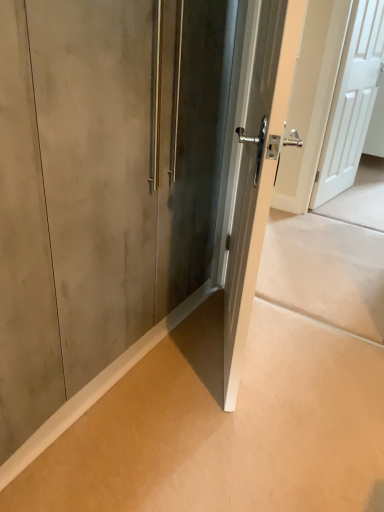
Describe the element at coordinates (351, 101) in the screenshot. The width and height of the screenshot is (384, 512). I see `white matte door at upper right, the 1th door viewed from the right` at that location.

You are a GUI agent. You are given a task and a screenshot of the screen. Output one action in this format:
    pyautogui.click(x=<x>, y=<y>)
    Task: Click on the matte concrete wall at lower left
    
    Given the screenshot: What is the action you would take?
    pyautogui.click(x=226, y=426)

Where is `satin silver door at center, placed as the 1th door when sorted from left to right`? satin silver door at center, placed as the 1th door when sorted from left to right is located at coordinates (256, 164).

Does point (328, 149) lie behind point (133, 449)?

Yes.

Which of these two, white matte door at upper right, the 1th door viewed from the right, or matte concrete wall at lower left, stands taller?

white matte door at upper right, the 1th door viewed from the right.

Considering the relative sizes of white matte door at upper right, which ranks as the second door in left-to-right order, and matte concrete wall at lower left in the image provided, is white matte door at upper right, which ranks as the second door in left-to-right order, bigger than matte concrete wall at lower left?

Yes, white matte door at upper right, which ranks as the second door in left-to-right order, is bigger than matte concrete wall at lower left.

At what (x,y) coordinates should I click in order to perform the action: click on concrete located below the white matte door at upper right, the 1th door from the back (from the image's perspective). Please return your answer as a coordinate pair (x, y). Looking at the image, I should click on (226, 426).

Is there a large distance between satin silver door at center, placed as the 1th door when sorted from left to right, and matte concrete wall at lower left?

They are positioned close to each other.

Considering the relative sizes of satin silver door at center, acting as the first door starting from the front, and matte concrete wall at lower left in the image provided, is satin silver door at center, acting as the first door starting from the front, bigger than matte concrete wall at lower left?

Indeed, satin silver door at center, acting as the first door starting from the front, has a larger size compared to matte concrete wall at lower left.

Is matte concrete wall at lower left surrounded by satin silver door at center, arranged as the 2th door when viewed from the right?

No, matte concrete wall at lower left is located outside of satin silver door at center, arranged as the 2th door when viewed from the right.

Is the position of satin silver door at center, arranged as the 2th door when viewed from the right, less distant than that of matte concrete wall at lower left?

That is False.

Considering the sizes of objects white matte door at upper right, the 1th door viewed from the right, and satin silver door at center, placed as the 1th door when sorted from left to right, in the image provided, who is smaller, white matte door at upper right, the 1th door viewed from the right, or satin silver door at center, placed as the 1th door when sorted from left to right,?

With smaller size is satin silver door at center, placed as the 1th door when sorted from left to right.

Consider the image. Is white matte door at upper right, which ranks as the second door in left-to-right order, inside the boundaries of satin silver door at center, the 2th door positioned from the back, or outside?

white matte door at upper right, which ranks as the second door in left-to-right order, lies outside satin silver door at center, the 2th door positioned from the back.

Is satin silver door at center, placed as the 1th door when sorted from left to right, at the back of white matte door at upper right, which ranks as the second door in left-to-right order?

No, satin silver door at center, placed as the 1th door when sorted from left to right, is not at the back of white matte door at upper right, which ranks as the second door in left-to-right order.

Considering the sizes of objects matte concrete wall at lower left and white matte door at upper right, which ranks as the 2th door in front-to-back order, in the image provided, who is taller, matte concrete wall at lower left or white matte door at upper right, which ranks as the 2th door in front-to-back order,?

Standing taller between the two is white matte door at upper right, which ranks as the 2th door in front-to-back order.

Is there a large distance between matte concrete wall at lower left and white matte door at upper right, the 1th door viewed from the right?

That's right, there is a large distance between matte concrete wall at lower left and white matte door at upper right, the 1th door viewed from the right.

This screenshot has width=384, height=512. What are the coordinates of `door that is the 2nd object located above the matte concrete wall at lower left (from the image's perspective)` in the screenshot? It's located at (351, 101).

What's the angular difference between matte concrete wall at lower left and satin silver door at center, acting as the first door starting from the front,'s facing directions?

They differ by 64 degrees in their facing directions.

Is matte concrete wall at lower left facing away from satin silver door at center, arranged as the 2th door when viewed from the right?

No, matte concrete wall at lower left is not facing the opposite direction of satin silver door at center, arranged as the 2th door when viewed from the right.

Which object is wider, matte concrete wall at lower left or satin silver door at center, placed as the 1th door when sorted from left to right?

With larger width is matte concrete wall at lower left.

In the scene shown: Does satin silver door at center, acting as the first door starting from the front, have a lesser height compared to white matte door at upper right, the 1th door viewed from the right?

Yes, satin silver door at center, acting as the first door starting from the front, is shorter than white matte door at upper right, the 1th door viewed from the right.

Is satin silver door at center, placed as the 1th door when sorted from left to right, positioned with its back to white matte door at upper right, which ranks as the 2th door in front-to-back order?

No, white matte door at upper right, which ranks as the 2th door in front-to-back order, is not at the back of satin silver door at center, placed as the 1th door when sorted from left to right.

Is point (252, 271) closer or farther from the camera than point (340, 170)?

Point (252, 271).

Is satin silver door at center, the 2th door positioned from the back, at the left side of white matte door at upper right, which ranks as the second door in left-to-right order?

Yes.

What are the coordinates of `concrete beneath the white matte door at upper right, which ranks as the 2th door in front-to-back order (from a real-world perspective)` in the screenshot? It's located at point(226,426).

At what (x,y) coordinates should I click in order to perform the action: click on the 1st door behind when counting from the matte concrete wall at lower left. Please return your answer as a coordinate pair (x, y). The image size is (384, 512). Looking at the image, I should click on (256, 164).

Looking at the image, which one is located closer to white matte door at upper right, the 1th door from the back, satin silver door at center, acting as the first door starting from the front, or matte concrete wall at lower left?

satin silver door at center, acting as the first door starting from the front, is closer to white matte door at upper right, the 1th door from the back.

Based on their spatial positions, is matte concrete wall at lower left or satin silver door at center, placed as the 1th door when sorted from left to right, further from white matte door at upper right, which ranks as the second door in left-to-right order?

matte concrete wall at lower left lies further to white matte door at upper right, which ranks as the second door in left-to-right order, than the other object.

Estimate the real-world distances between objects in this image. Which object is further from matte concrete wall at lower left, white matte door at upper right, which ranks as the 2th door in front-to-back order, or satin silver door at center, acting as the first door starting from the front?

white matte door at upper right, which ranks as the 2th door in front-to-back order.

When comparing their distances from satin silver door at center, arranged as the 2th door when viewed from the right, does matte concrete wall at lower left or white matte door at upper right, which ranks as the 2th door in front-to-back order, seem closer?

Among the two, matte concrete wall at lower left is located nearer to satin silver door at center, arranged as the 2th door when viewed from the right.

Consider the image. When comparing their distances from satin silver door at center, placed as the 1th door when sorted from left to right, does white matte door at upper right, which ranks as the 2th door in front-to-back order, or matte concrete wall at lower left seem further?

white matte door at upper right, which ranks as the 2th door in front-to-back order, is further to satin silver door at center, placed as the 1th door when sorted from left to right.

Based on their spatial positions, is satin silver door at center, the 2th door positioned from the back, or white matte door at upper right, the 1th door viewed from the right, closer to matte concrete wall at lower left?

Based on the image, satin silver door at center, the 2th door positioned from the back, appears to be nearer to matte concrete wall at lower left.

This screenshot has width=384, height=512. Identify the location of door positioned between matte concrete wall at lower left and white matte door at upper right, which ranks as the 2th door in front-to-back order, from near to far. (256, 164).